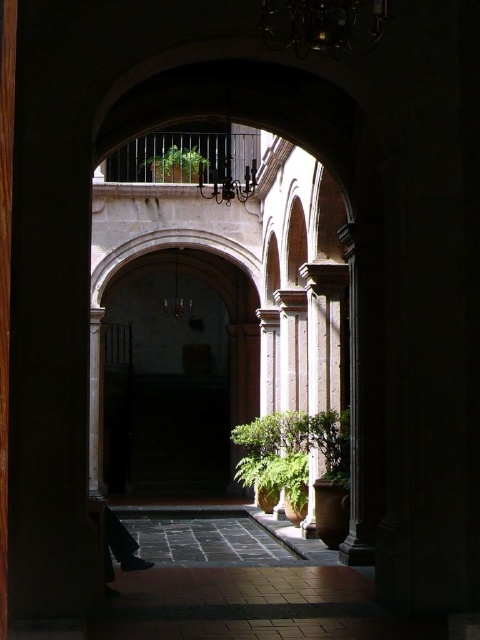
Question: Does green leafy plant at center have a smaller size compared to green leafy plant at upper center?

Choices:
 (A) yes
 (B) no

Answer: (B)

Question: Considering the relative positions of green leafy plant at lower center and green leafy plant at upper center in the image provided, where is green leafy plant at lower center located with respect to green leafy plant at upper center?

Choices:
 (A) right
 (B) left

Answer: (A)

Question: Which of the following is the farthest from the observer?

Choices:
 (A) green leafy plant at center
 (B) green leafy plant at upper center
 (C) smooth stone archway at center

Answer: (B)

Question: Can you confirm if smooth stone archway at center is positioned above green leafy plant at upper center?

Choices:
 (A) yes
 (B) no

Answer: (B)

Question: Among these objects, which one is farthest from the camera?

Choices:
 (A) green leafy plant at upper center
 (B) green leafy plant at center
 (C) smooth stone archway at center

Answer: (A)

Question: Which point is farther to the camera?

Choices:
 (A) green leafy plant at lower center
 (B) green leafy plant at center
 (C) smooth stone archway at center

Answer: (C)